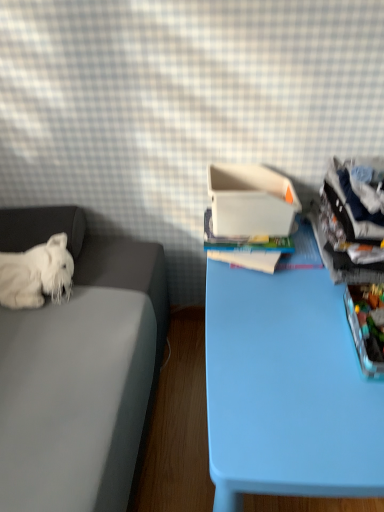
Question: Is light blue plastic table at center to the right of white plush dog at left from the viewer's perspective?

Choices:
 (A) no
 (B) yes

Answer: (B)

Question: Is light blue plastic table at center thinner than white plush dog at left?

Choices:
 (A) no
 (B) yes

Answer: (A)

Question: Is light blue plastic table at center shorter than white plush dog at left?

Choices:
 (A) no
 (B) yes

Answer: (A)

Question: Is light blue plastic table at center to the left of white plush dog at left from the viewer's perspective?

Choices:
 (A) yes
 (B) no

Answer: (B)

Question: Considering the relative sizes of light blue plastic table at center and white plush dog at left in the image provided, is light blue plastic table at center wider than white plush dog at left?

Choices:
 (A) no
 (B) yes

Answer: (B)

Question: In the image, is white plush dog at left positioned in front of or behind translucent plastic storage box at right?

Choices:
 (A) behind
 (B) front

Answer: (A)

Question: Is white plush dog at left taller or shorter than translucent plastic storage box at right?

Choices:
 (A) short
 (B) tall

Answer: (B)

Question: Is white plush dog at left bigger or smaller than translucent plastic storage box at right?

Choices:
 (A) big
 (B) small

Answer: (B)

Question: In terms of width, does white plush dog at left look wider or thinner when compared to translucent plastic storage box at right?

Choices:
 (A) wide
 (B) thin

Answer: (B)

Question: From a real-world perspective, is light blue plastic table at center positioned above or below white plush dog at left?

Choices:
 (A) above
 (B) below

Answer: (B)

Question: Is light blue plastic table at center wider or thinner than white plush dog at left?

Choices:
 (A) thin
 (B) wide

Answer: (B)

Question: Based on their positions, is light blue plastic table at center located to the left or right of white plush dog at left?

Choices:
 (A) left
 (B) right

Answer: (B)

Question: Considering the positions of light blue plastic table at center and white plush dog at left in the image, is light blue plastic table at center taller or shorter than white plush dog at left?

Choices:
 (A) short
 (B) tall

Answer: (B)

Question: From a real-world perspective, is white plush dog at left physically located above or below light blue plastic table at center?

Choices:
 (A) below
 (B) above

Answer: (B)

Question: From the image's perspective, is white plush dog at left positioned above or below light blue plastic table at center?

Choices:
 (A) above
 (B) below

Answer: (A)